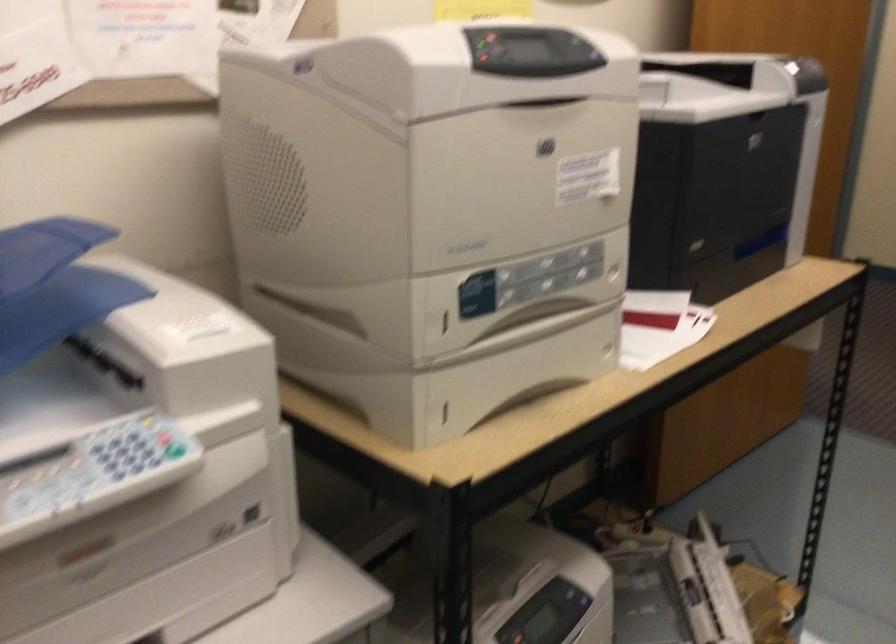
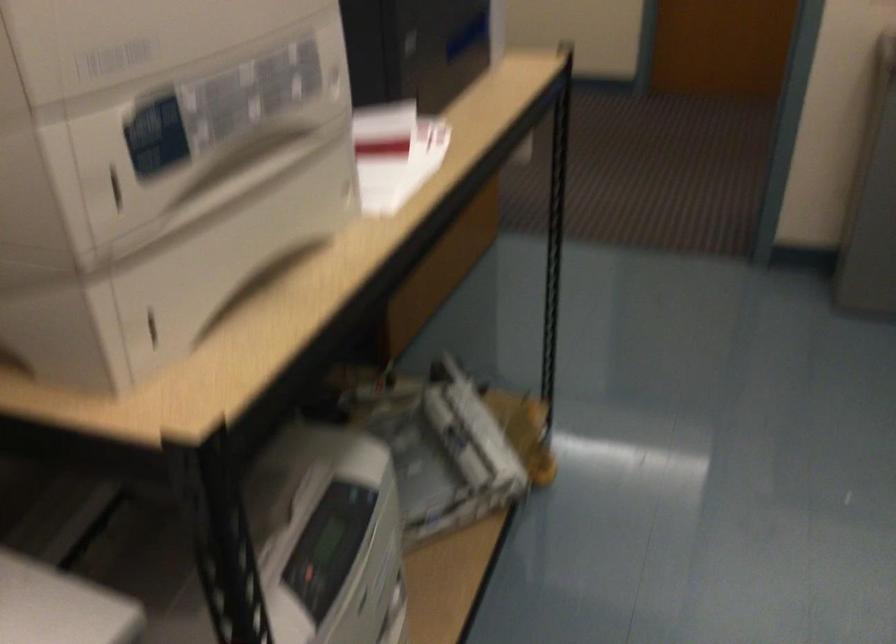
The point at (442, 413) is marked in the first image. Where is the corresponding point in the second image?

(151, 327)